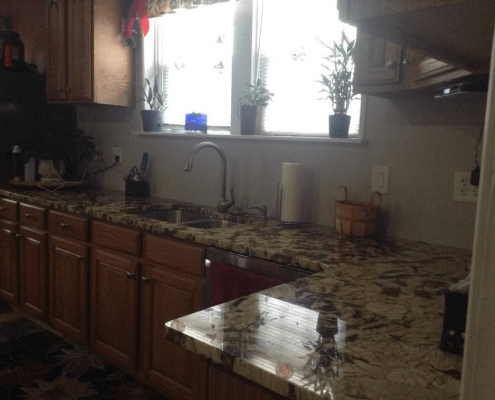
At what (x,y) coordinates should I click in order to perform the action: click on faucet. Please return your answer as a coordinate pair (x, y). Looking at the image, I should click on (223, 181).